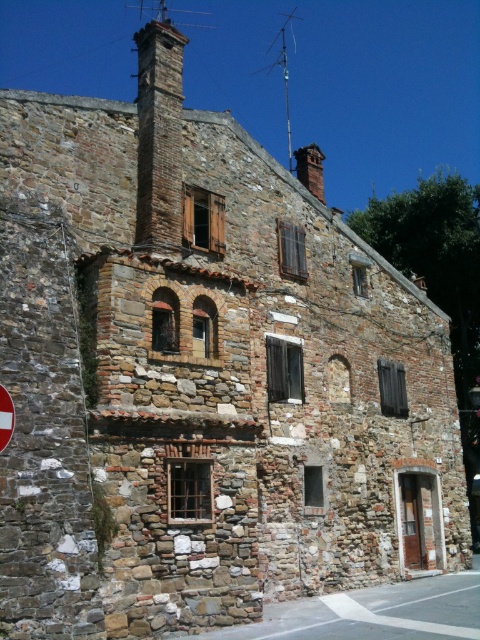
You are an architect analyzing the roof structure of the building. You notice the red brick chimney at upper center and the metallic antenna at upper center. Which object has a greater width?

The red brick chimney at upper center has a greater width than the metallic antenna at upper center.

You are standing in front of the rustic stone building and notice two points marked on the facade. The first point is at coordinate (x=310, y=189) and the second is at (x=2, y=387). From your perspective, which point is closer to you?

Point (x=2, y=387) is closer to you because it is in front of point (x=310, y=189).